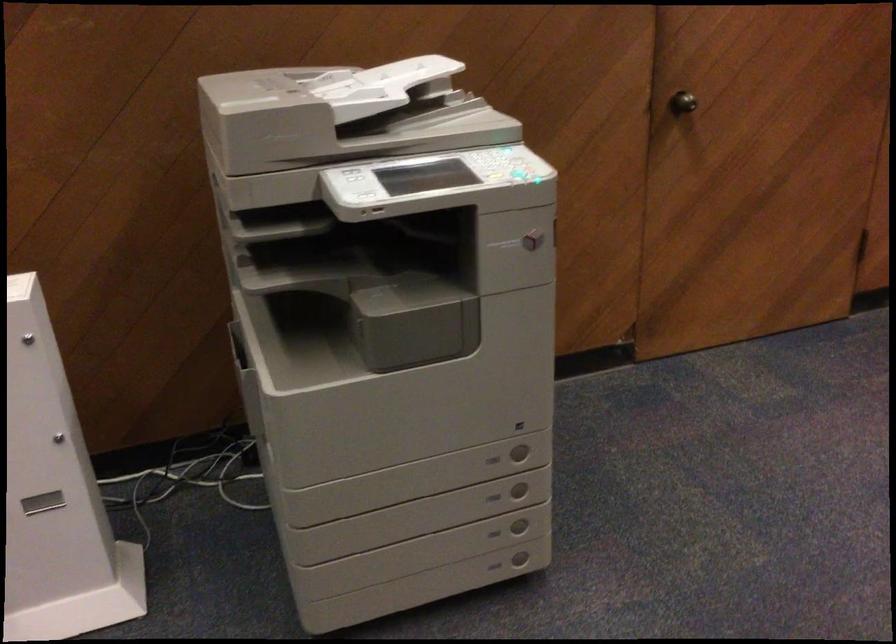
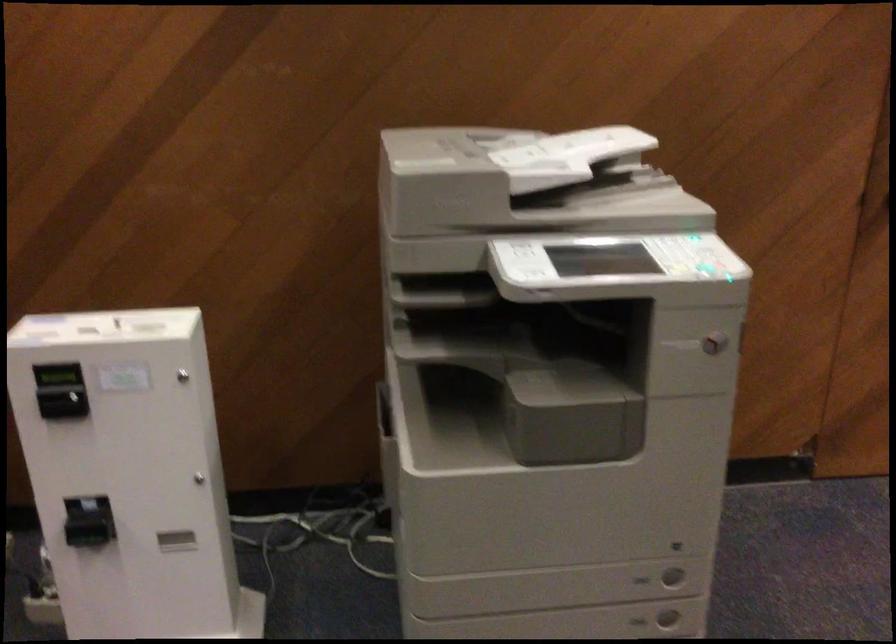
Locate, in the second image, the point that corresponds to pixel 510 176 in the first image.

(698, 266)